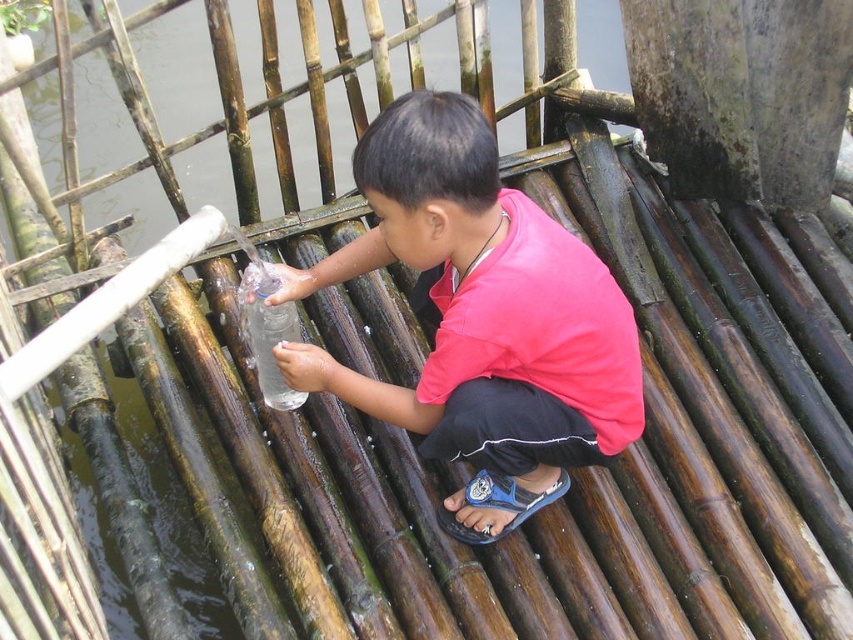
Is point (285, 193) less distant than point (538, 490)?

No, (285, 193) is further to viewer.

What do you see at coordinates (366, 502) in the screenshot? The width and height of the screenshot is (853, 640). I see `transparent plastic water at center` at bounding box center [366, 502].

Where is `transparent plastic water at center`? transparent plastic water at center is located at coordinates point(366,502).

Locate an element on the screen. The height and width of the screenshot is (640, 853). transparent plastic water at center is located at coordinates (366, 502).

Does transparent plastic water at center appear over clear plastic bottle at center?

Yes, transparent plastic water at center is above clear plastic bottle at center.

Is transparent plastic water at center shorter than clear plastic bottle at center?

In fact, transparent plastic water at center may be taller than clear plastic bottle at center.

Find the location of a particular element. The height and width of the screenshot is (640, 853). transparent plastic water at center is located at coordinates (366, 502).

Can you confirm if matte plastic bottle at center is bigger than clear plastic bottle at center?

Indeed, matte plastic bottle at center has a larger size compared to clear plastic bottle at center.

Between matte plastic bottle at center and clear plastic bottle at center, which one has more height?

Standing taller between the two is matte plastic bottle at center.

Is point (503, 296) behind point (239, 284)?

That is False.

Where is `matte plastic bottle at center`? Image resolution: width=853 pixels, height=640 pixels. matte plastic bottle at center is located at coordinates (480, 317).